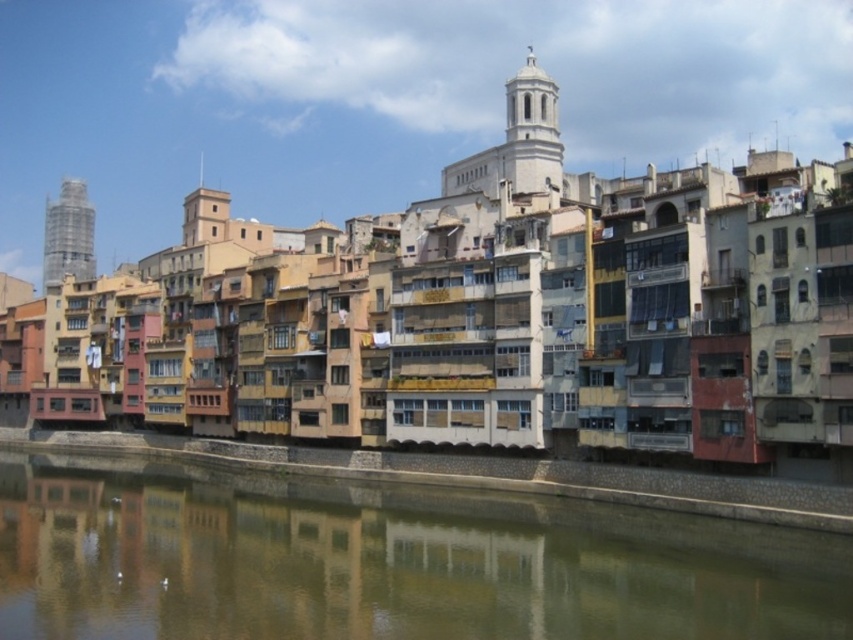
Question: Is smooth concrete river at center smaller than smooth gray concrete tower at left?

Choices:
 (A) no
 (B) yes

Answer: (B)

Question: Which point appears closest to the camera in this image?

Choices:
 (A) (90, 278)
 (B) (463, 588)

Answer: (B)

Question: Which point is farther from the camera taking this photo?

Choices:
 (A) (302, 516)
 (B) (61, 218)

Answer: (B)

Question: Which point is farther to the camera?

Choices:
 (A) smooth concrete river at center
 (B) smooth gray concrete tower at left

Answer: (B)

Question: Does smooth concrete river at center have a larger size compared to smooth gray concrete tower at left?

Choices:
 (A) yes
 (B) no

Answer: (B)

Question: Is smooth concrete river at center closer to camera compared to smooth gray concrete tower at left?

Choices:
 (A) yes
 (B) no

Answer: (A)